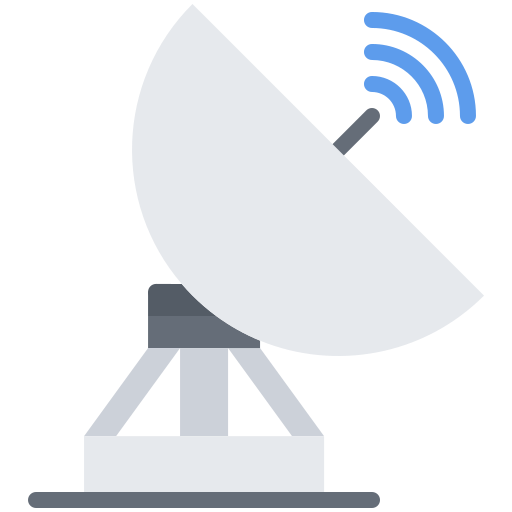
Where is `receiver`? The height and width of the screenshot is (512, 512). receiver is located at coordinates (355, 127).